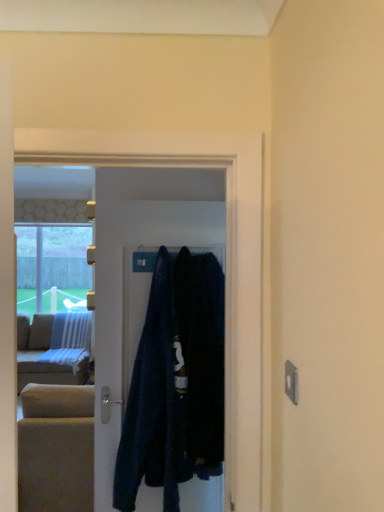
Question: From a real-world perspective, relative to dark blue fabric at center, is dark blue fabric at center, the 2th clothing in the right-to-left sequence, vertically above or below?

Choices:
 (A) below
 (B) above

Answer: (A)

Question: Based on their positions, is dark blue fabric at center, the 2th clothing in the right-to-left sequence, located to the left or right of dark blue fabric at center?

Choices:
 (A) right
 (B) left

Answer: (B)

Question: Which is nearer to the dark blue fabric at center?

Choices:
 (A) dark blue fabric coat at center, positioned as the 2th clothing in left-to-right order
 (B) dark blue fabric at center, the 1th clothing viewed from the left

Answer: (B)

Question: Which object is positioned closest to the dark blue fabric at center, the 2th clothing in the right-to-left sequence?

Choices:
 (A) dark blue fabric at center
 (B) dark blue fabric coat at center, positioned as the 2th clothing in left-to-right order

Answer: (B)